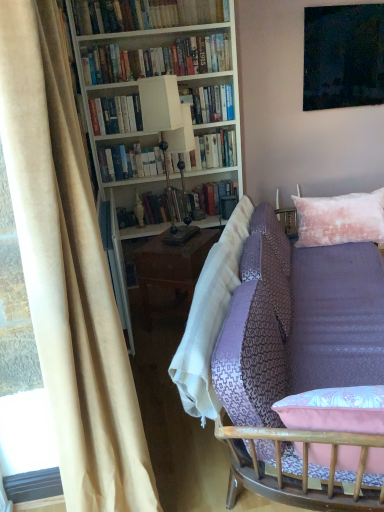
Question: Is hardcover book at upper center, placed as the second book when sorted from bottom to top, in contact with beige velvet curtain at left?

Choices:
 (A) yes
 (B) no

Answer: (B)

Question: Does hardcover book at upper center, placed as the second book when sorted from bottom to top, have a lesser height compared to beige velvet curtain at left?

Choices:
 (A) no
 (B) yes

Answer: (B)

Question: Is hardcover book at upper center, the third book from the top, not within beige velvet curtain at left?

Choices:
 (A) no
 (B) yes

Answer: (B)

Question: From a real-world perspective, is hardcover book at upper center, placed as the second book when sorted from bottom to top, positioned over beige velvet curtain at left based on gravity?

Choices:
 (A) yes
 (B) no

Answer: (A)

Question: Considering the relative positions of hardcover book at upper center, placed as the second book when sorted from bottom to top, and beige velvet curtain at left in the image provided, is hardcover book at upper center, placed as the second book when sorted from bottom to top, to the left of beige velvet curtain at left from the viewer's perspective?

Choices:
 (A) no
 (B) yes

Answer: (A)

Question: Does hardcover book at upper center, the third book from the top, have a greater height compared to beige velvet curtain at left?

Choices:
 (A) yes
 (B) no

Answer: (B)

Question: Can you confirm if purple fabric couch at lower right is bigger than white wood bookcase at upper left?

Choices:
 (A) no
 (B) yes

Answer: (B)

Question: Is purple fabric couch at lower right positioned far away from white wood bookcase at upper left?

Choices:
 (A) no
 (B) yes

Answer: (B)

Question: Can white wood bookcase at upper left be found inside purple fabric couch at lower right?

Choices:
 (A) no
 (B) yes

Answer: (A)

Question: Is purple fabric couch at lower right placed right next to white wood bookcase at upper left?

Choices:
 (A) yes
 (B) no

Answer: (B)

Question: From a real-world perspective, is purple fabric couch at lower right on top of white wood bookcase at upper left?

Choices:
 (A) yes
 (B) no

Answer: (B)

Question: Can you confirm if purple fabric couch at lower right is smaller than white wood bookcase at upper left?

Choices:
 (A) yes
 (B) no

Answer: (B)

Question: Is pink textured pillow at upper right to the right of hardcover books at upper center, arranged as the third book when ordered from the bottom, from the viewer's perspective?

Choices:
 (A) no
 (B) yes

Answer: (B)